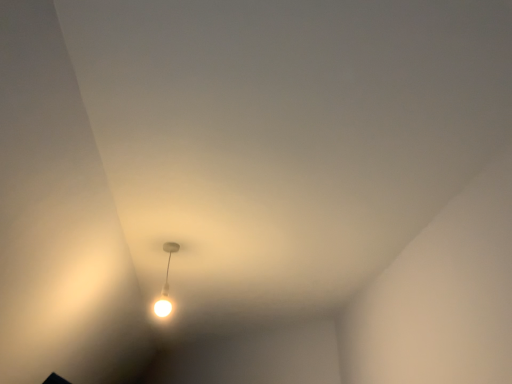
Locate an element on the screen. Image resolution: width=512 pixels, height=384 pixels. white glossy bulb at center is located at coordinates (165, 284).

This screenshot has width=512, height=384. What do you see at coordinates (165, 284) in the screenshot?
I see `white glossy bulb at center` at bounding box center [165, 284].

This screenshot has height=384, width=512. I want to click on white glossy bulb at center, so click(165, 284).